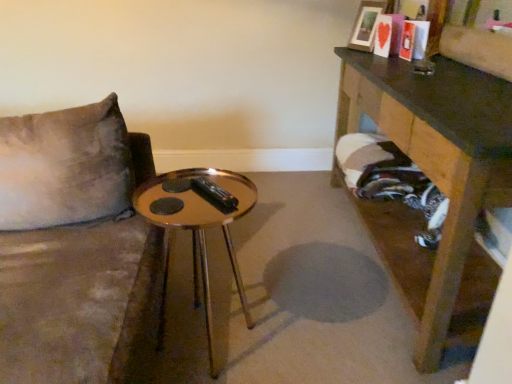
This screenshot has height=384, width=512. I want to click on spots to the right of gold reflective table at center, placed as the first table when sorted from left to right, so click(303, 330).